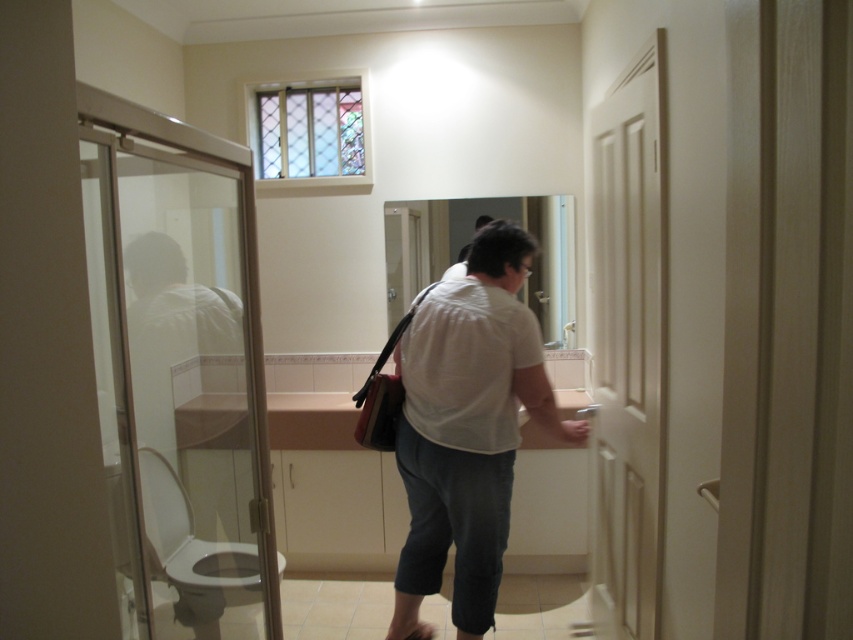
Question: Which point is farther from the camera taking this photo?

Choices:
 (A) (169, 570)
 (B) (560, 445)
 (C) (161, 429)

Answer: (B)

Question: Does transparent glass door at left have a larger size compared to white matte shirt at center?

Choices:
 (A) yes
 (B) no

Answer: (A)

Question: Is the position of matte white toilet bowl at lower left less distant than that of white glossy sink at center?

Choices:
 (A) no
 (B) yes

Answer: (B)

Question: Which point appears farthest from the camera in this image?

Choices:
 (A) (606, 365)
 (B) (213, 593)
 (C) (399, 442)
 (D) (190, 602)

Answer: (A)

Question: From the image, what is the correct spatial relationship of transparent glass door at left in relation to white glossy toilet bowl at lower left?

Choices:
 (A) left
 (B) right

Answer: (B)

Question: Which point appears closest to the camera in this image?

Choices:
 (A) (169, 579)
 (B) (219, 584)
 (C) (509, 490)

Answer: (A)